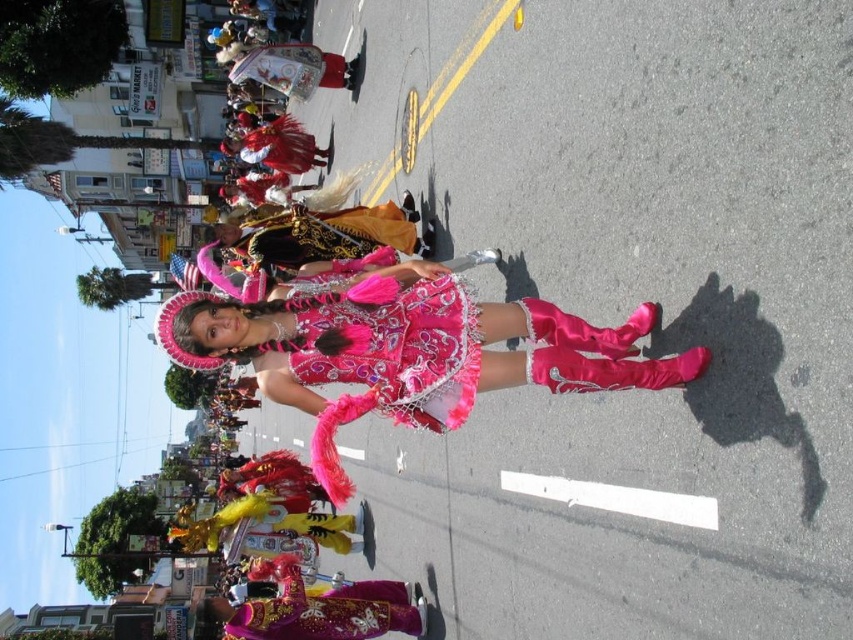
Does shiny satin dress at center have a greater height compared to velvet gold and black vest at center?

Yes.

Between shiny satin dress at center and velvet gold and black vest at center, which one is positioned lower?

shiny satin dress at center

Locate an element on the screen. The image size is (853, 640). shiny satin dress at center is located at coordinates (405, 352).

Identify the location of shiny gold fabric at center. (329, 612).

Between shiny gold fabric at center and velvet gold and black vest at center, which one appears on the right side from the viewer's perspective?

From the viewer's perspective, velvet gold and black vest at center appears more on the right side.

You are a GUI agent. You are given a task and a screenshot of the screen. Output one action in this format:
    pyautogui.click(x=<x>, y=<y>)
    Task: Click on the shiny gold fabric at center
    This screenshot has width=853, height=640.
    Given the screenshot: What is the action you would take?
    pyautogui.click(x=329, y=612)

Find the location of a particular element. The height and width of the screenshot is (640, 853). shiny gold fabric at center is located at coordinates (329, 612).

Does shiny satin dress at center come behind shiny gold fabric at center?

That is False.

Based on the photo, is shiny satin dress at center to the left of shiny gold fabric at center from the viewer's perspective?

In fact, shiny satin dress at center is to the right of shiny gold fabric at center.

Is point (415, 269) positioned after point (271, 602)?

No, (415, 269) is in front of (271, 602).

The image size is (853, 640). I want to click on shiny satin dress at center, so click(405, 352).